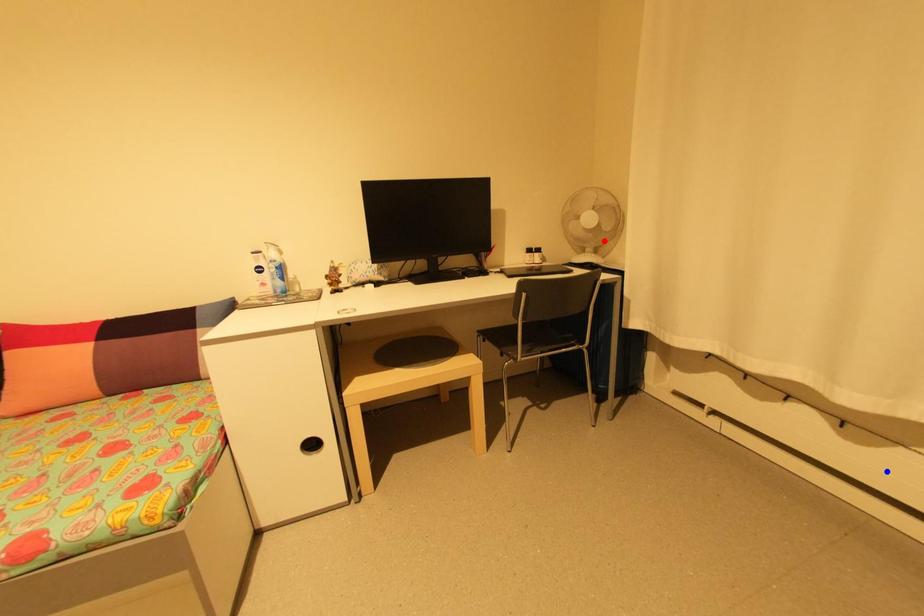
Question: Which of the two points in the image is closer to the camera?

Choices:
 (A) Blue point is closer.
 (B) Red point is closer.

Answer: (A)